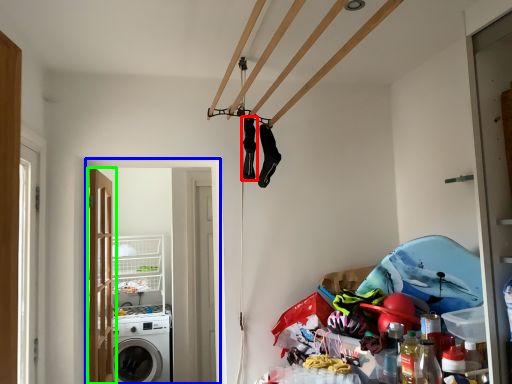
Question: Which object is positioned closest to clothing (highlighted by a red box)? Select from screen door (highlighted by a blue box) and door (highlighted by a green box).

Choices:
 (A) screen door
 (B) door

Answer: (B)